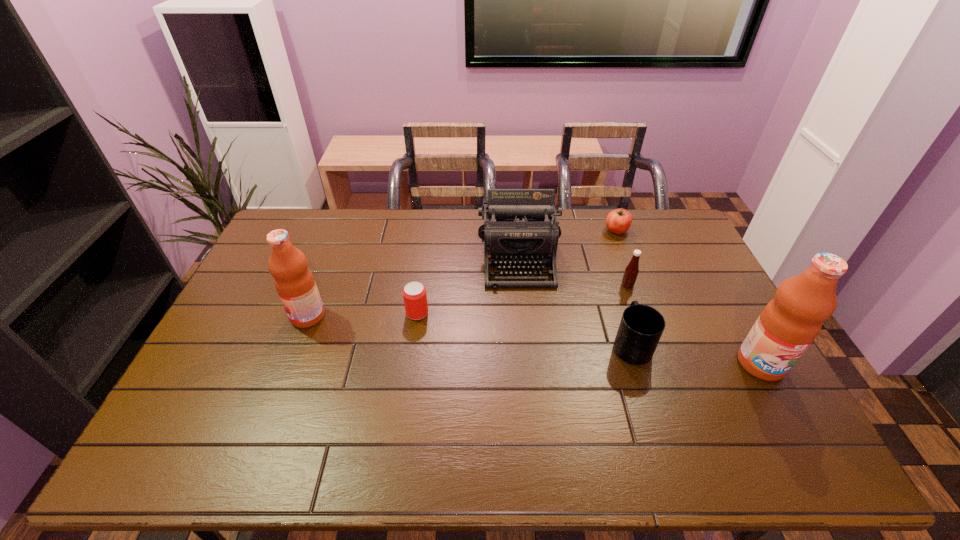
I want to click on the sixth shortest object, so click(294, 282).

At what (x,y) coordinates should I click in order to perform the action: click on the farther fruit juice. Please return your answer as a coordinate pair (x, y). The image size is (960, 540). Looking at the image, I should click on (294, 282).

At what (x,y) coordinates should I click in order to perform the action: click on the tallest object. Please return your answer as a coordinate pair (x, y). Looking at the image, I should click on (789, 323).

The height and width of the screenshot is (540, 960). What are the coordinates of `the taller fruit juice` in the screenshot? It's located at (789, 323).

Image resolution: width=960 pixels, height=540 pixels. What are the coordinates of `apple` in the screenshot? It's located at pyautogui.click(x=618, y=221).

You are a GUI agent. You are given a task and a screenshot of the screen. Output one action in this format:
    pyautogui.click(x=<x>, y=<y>)
    Task: Click on the fifth shortest object
    This screenshot has width=960, height=540.
    Given the screenshot: What is the action you would take?
    [x=519, y=229]

The height and width of the screenshot is (540, 960). In order to click on the fifth object from right to left in this screenshot , I will do `click(519, 229)`.

Where is `mug`? mug is located at coordinates (641, 326).

The height and width of the screenshot is (540, 960). What are the coordinates of `beer can` in the screenshot? It's located at (414, 293).

The height and width of the screenshot is (540, 960). What are the coordinates of `Tabasco sauce` in the screenshot? It's located at (631, 272).